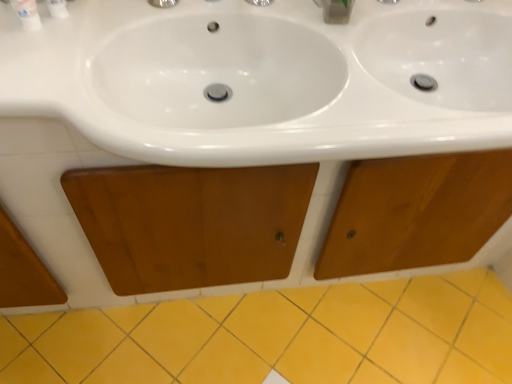
Locate an element on the screen. The height and width of the screenshot is (384, 512). free region on the left part of clear plastic container at upper center is located at coordinates (281, 21).